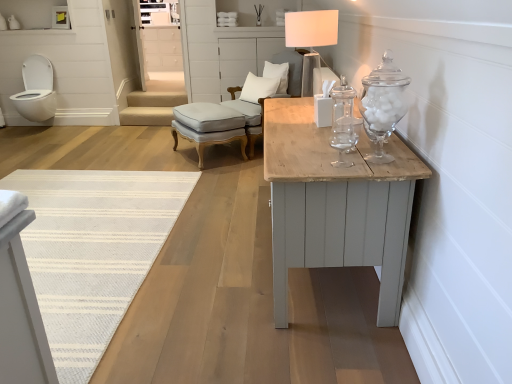
Question: Considering their positions, is white painted wood drawer at upper center located in front of or behind clear glass jar at center?

Choices:
 (A) front
 (B) behind

Answer: (B)

Question: Choose the correct answer: Is white painted wood drawer at upper center inside clear glass jar at center or outside it?

Choices:
 (A) inside
 (B) outside

Answer: (B)

Question: Based on their relative distances, which object is farther from the white cotton pillow at upper center, which is counted as the second pillow, starting from the top?

Choices:
 (A) white fabric lampshade at upper center
 (B) white painted wood drawer at upper center
 (C) white glossy toilet at left
 (D) white painted wood dresser at upper center
 (E) clear glass jar at center

Answer: (C)

Question: Estimate the real-world distances between objects in this image. Which object is farther from the white fabric lampshade at upper center?

Choices:
 (A) light gray fabric stool at center
 (B) white soft pillow at upper center, the 1th pillow viewed from the top
 (C) light gray fabric armchair at center
 (D) white painted wood drawer at upper center
 (E) clear glass jar at center

Answer: (D)